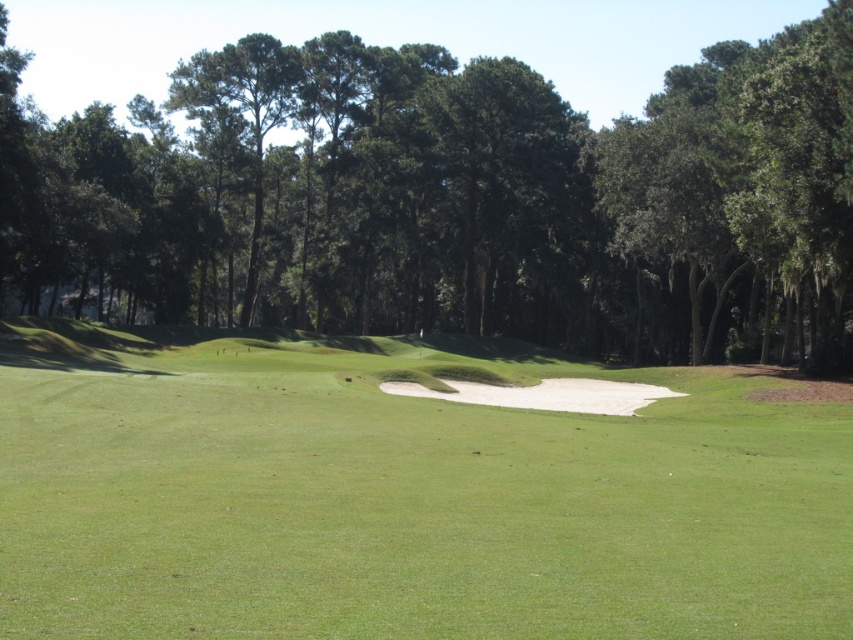
Does green grassy golf course at center have a lesser height compared to green leafy tree at center?

Correct, green grassy golf course at center is not as tall as green leafy tree at center.

Is green grassy golf course at center to the right of green leafy tree at center from the viewer's perspective?

Yes, green grassy golf course at center is to the right of green leafy tree at center.

The image size is (853, 640). I want to click on green grassy golf course at center, so click(402, 496).